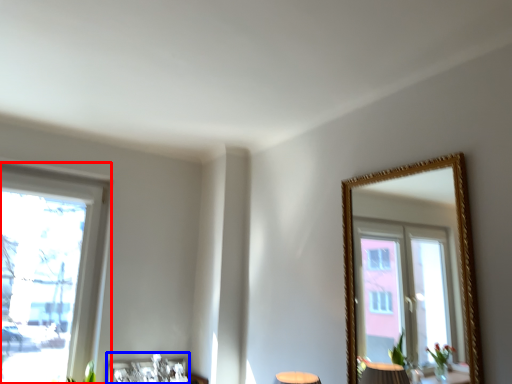
Question: Which point is closer to the camera, window (highlighted by a red box) or picture frame (highlighted by a blue box)?

Choices:
 (A) window
 (B) picture frame

Answer: (A)